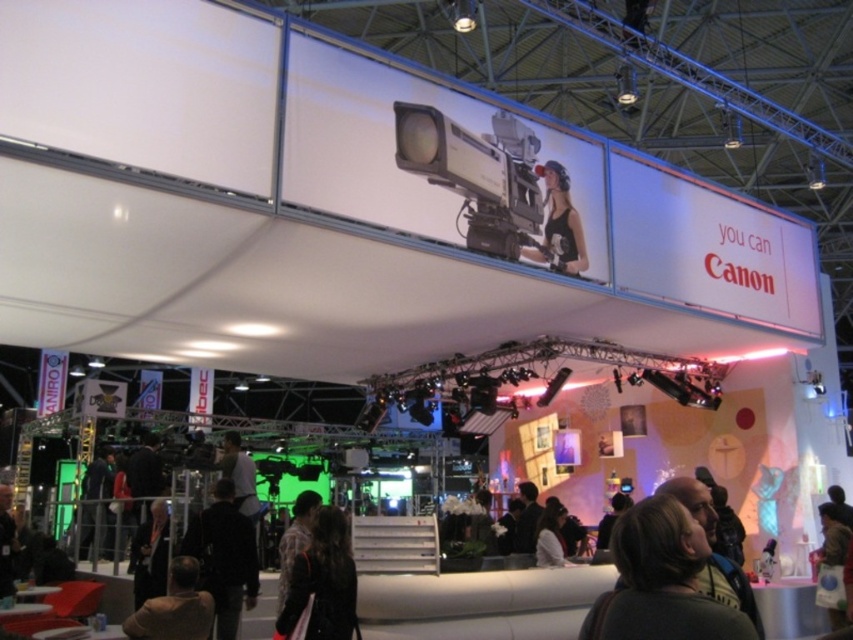
You are a photographer at the Canon booth and need to capture a clear photo of the Canon advertisement. Considering the dark brown hair at center and the black fabric jacket at lower center, which object is shorter and might obstruct the view if positioned too close?

The dark brown hair at center has a lesser height compared to the black fabric jacket at lower center, so it is shorter and might obstruct the view if positioned too close.

You are a photographer attending the Canon booth and notice the black fabric jacket at lower center and the matte black camera at upper center. Which object is located closer to the floor?

The black fabric jacket at lower center is positioned under the matte black camera at upper center, so it is closer to the floor.

You are a photographer at the Canon booth and want to capture a photo of the dark brown hair at center and the black fabric jacket at lower center. Which object should you focus on if you want to emphasize the smaller one in your shot?

You should focus on the dark brown hair at center because it has a lesser width compared to the black fabric jacket at lower center, making it the smaller object to emphasize.